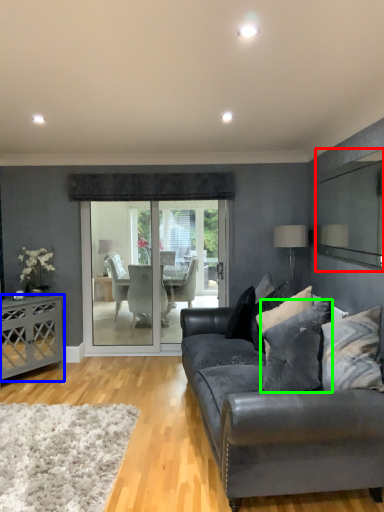
Question: Based on their relative distances, which object is farther from mirror (highlighted by a red box)? Choose from desk (highlighted by a blue box) and pillow (highlighted by a green box).

Choices:
 (A) desk
 (B) pillow

Answer: (A)